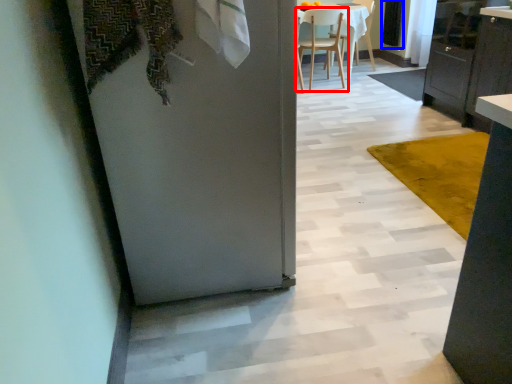
Question: Which of the following is the farthest to the observer, chair (highlighted by a red box) or screen door (highlighted by a blue box)?

Choices:
 (A) chair
 (B) screen door

Answer: (B)